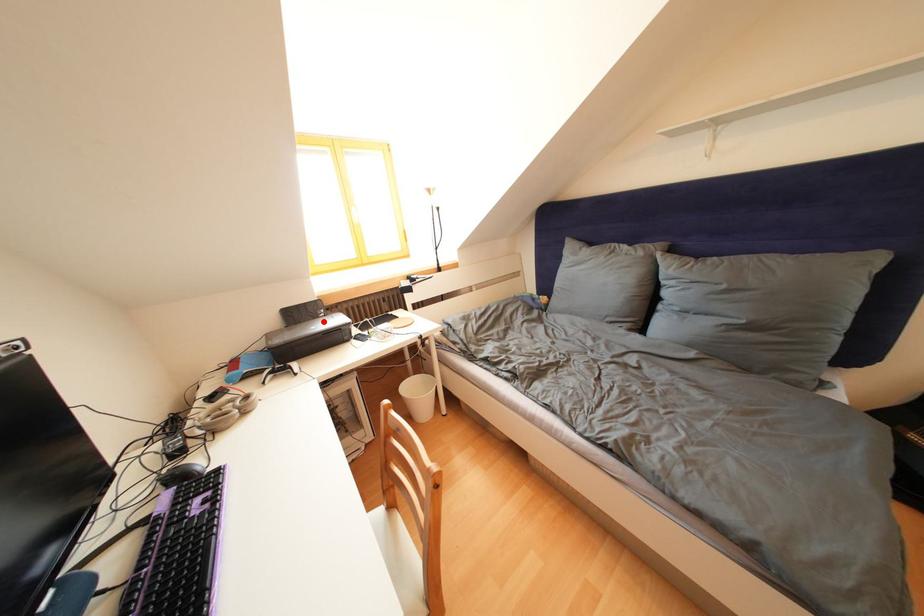
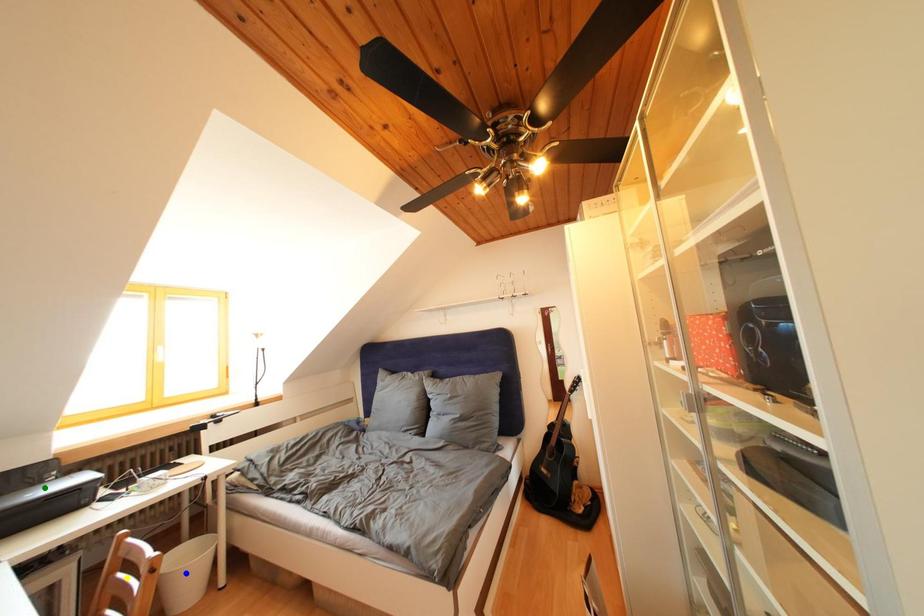
Question: I am providing you with two images of the same scene from different viewpoints. A red point is marked on the first image. You are given multiple points on the second image. In image 2, which mark is for the same physical point as the one in image 1?

Choices:
 (A) green point
 (B) yellow point
 (C) blue point

Answer: (A)